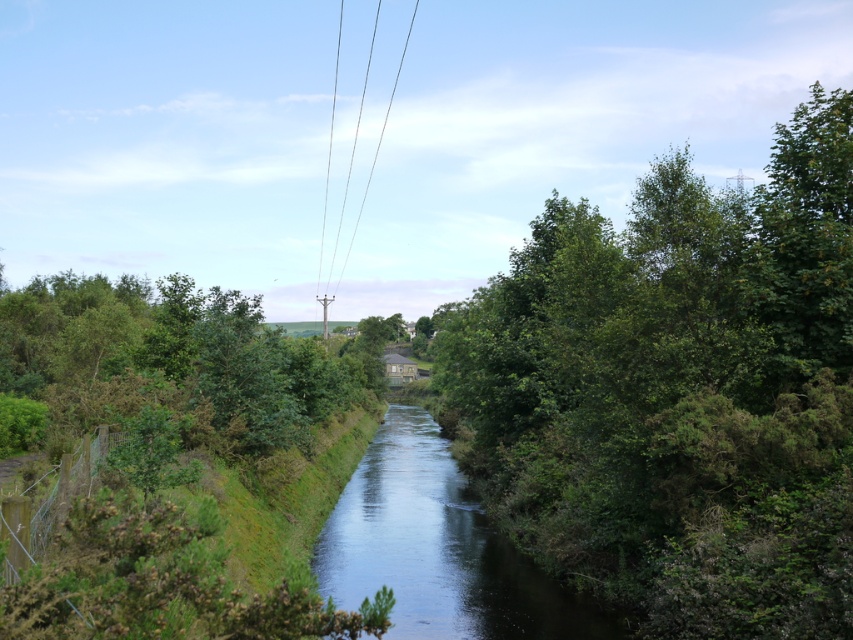
You are standing at the point labeled point (347, 512) and want to walk towards the point labeled point (386, 109). Given the rural landscape described, which direction should you face to move directly towards your destination?

You should face towards the left side of the scene because point (386, 109) is located to the left of point (347, 512) in the image.

You are a bird flying over the rural scene. You want to land on the highest point you can see. Which object should you choose between the green leafy tree at center right and the clear water at center?

The green leafy tree at center right is much taller than the clear water at center, so you should land on the green leafy tree at center right.